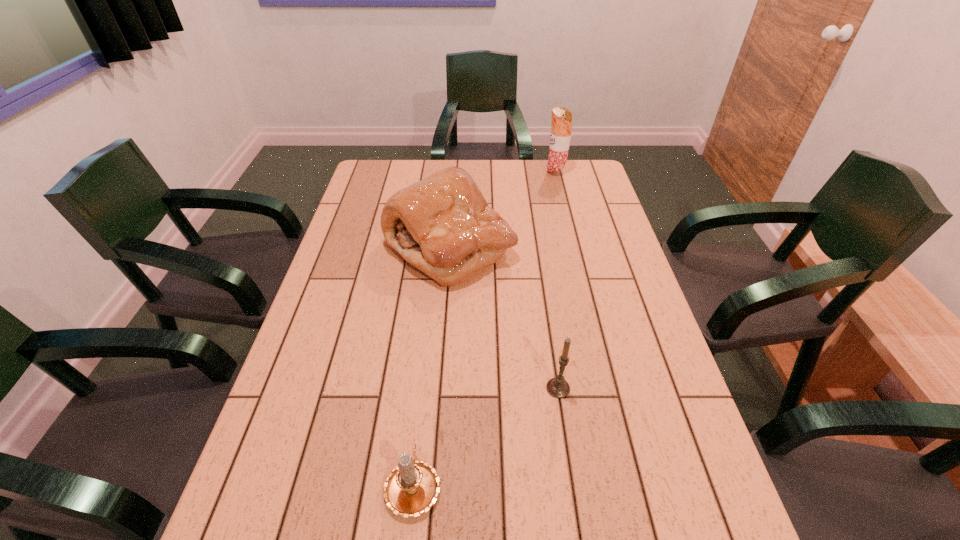
Image resolution: width=960 pixels, height=540 pixels. In order to click on object that is the closest one to the bread in this screenshot , I will do `click(561, 126)`.

In order to click on the closest object to the third object from left to right in this screenshot , I will do `click(412, 487)`.

You are a GUI agent. You are given a task and a screenshot of the screen. Output one action in this format:
    pyautogui.click(x=<x>, y=<y>)
    Task: Click on the free space that satisfies the following two spatial constraints: 1. on the filling side of the bread; 2. on the left side of the third object from left to right
    The image size is (960, 540).
    Given the screenshot: What is the action you would take?
    pyautogui.click(x=439, y=388)

Image resolution: width=960 pixels, height=540 pixels. I want to click on free region that satisfies the following two spatial constraints: 1. on the back side of the left candle; 2. on the right side of the taller candle, so click(x=423, y=388).

The width and height of the screenshot is (960, 540). I want to click on free location that satisfies the following two spatial constraints: 1. on the back side of the shortest object; 2. on the right side of the taller candle, so click(x=423, y=388).

At what (x,y) coordinates should I click in order to perform the action: click on free space that satisfies the following two spatial constraints: 1. on the filling side of the third shortest object; 2. on the right side of the right candle. Please return your answer as a coordinate pair (x, y). Looking at the image, I should click on (439, 388).

Identify the location of free space that satisfies the following two spatial constraints: 1. on the filling side of the bread; 2. on the back side of the farther candle. (439, 388).